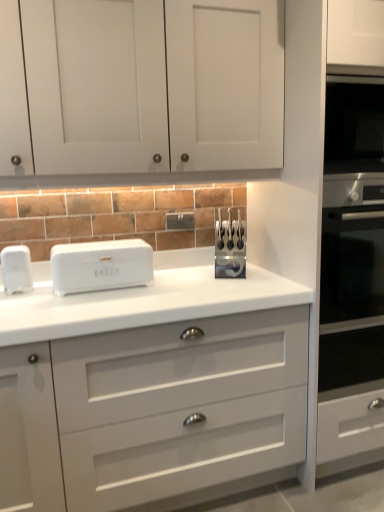
In order to face white glossy bread bin at center, placed as the second home appliance when sorted from left to right, should I rotate leftwards or rightwards?

Rotate left and turn 12.075 degrees.

What is the approximate height of white glossy bread bin at center, placed as the second home appliance when sorted from left to right?

white glossy bread bin at center, placed as the second home appliance when sorted from left to right, is 7.72 inches in height.

Find the location of a particular element. This screenshot has height=512, width=384. white plastic electric outlet at center is located at coordinates (180, 221).

Choose the correct answer: Is white glossy bread bin at center, placed as the second home appliance when sorted from left to right, inside white plastic bread bin at left, which appears as the first home appliance when viewed from the left, or outside it?

white glossy bread bin at center, placed as the second home appliance when sorted from left to right, is located beyond the bounds of white plastic bread bin at left, which appears as the first home appliance when viewed from the left.

There is a white glossy bread bin at center, placed as the second home appliance when sorted from left to right. Identify the location of home appliance above it (from a real-world perspective). The height and width of the screenshot is (512, 384). (16, 269).

Is white glossy bread bin at center, placed as the second home appliance when sorted from left to right, looking in the opposite direction of white plastic bread bin at left, which appears as the first home appliance when viewed from the left?

No, white glossy bread bin at center, placed as the second home appliance when sorted from left to right,'s orientation is not away from white plastic bread bin at left, which appears as the first home appliance when viewed from the left.

Is point (229, 370) less distant than point (180, 219)?

Yes, point (229, 370) is in front of point (180, 219).

Is white glossy chest of drawers at center looking in the opposite direction of white plastic electric outlet at center?

No, white plastic electric outlet at center is not at the back of white glossy chest of drawers at center.

From a real-world perspective, is white glossy chest of drawers at center positioned under white plastic electric outlet at center based on gravity?

Correct, in the physical world, white glossy chest of drawers at center is lower than white plastic electric outlet at center.

Identify the location of chest of drawers below the white plastic electric outlet at center (from a real-world perspective). (150, 386).

From a real-world perspective, between white glossy bread bin at center, placed as the second home appliance when sorted from left to right, and white matte cabinet doors at upper center, who is vertically higher?

white matte cabinet doors at upper center.

Between white glossy bread bin at center, placed as the second home appliance when sorted from left to right, and white matte cabinet doors at upper center, which one has smaller size?

white glossy bread bin at center, placed as the second home appliance when sorted from left to right.

From the image's perspective, which object appears higher, white glossy bread bin at center, placed as the second home appliance when sorted from left to right, or white matte cabinet doors at upper center?

white matte cabinet doors at upper center appears higher in the image.

Is white glossy bread bin at center, placed as the second home appliance when sorted from left to right, with white matte cabinet doors at upper center?

white glossy bread bin at center, placed as the second home appliance when sorted from left to right, is not next to white matte cabinet doors at upper center, and they're not touching.

Looking at this image, is white plastic electric outlet at center beside white glossy chest of drawers at center?

There is a gap between white plastic electric outlet at center and white glossy chest of drawers at center.

Measure the distance from white plastic electric outlet at center to white glossy chest of drawers at center.

A distance of 88.50 centimeters exists between white plastic electric outlet at center and white glossy chest of drawers at center.

Consider the image. Is white plastic electric outlet at center not within white glossy chest of drawers at center?

Yes.

From the image's perspective, between white glossy bread bin at center, positioned as the first home appliance in right-to-left order, and white glossy chest of drawers at center, which one is located above?

white glossy bread bin at center, positioned as the first home appliance in right-to-left order, from the image's perspective.

Which is in front, point (94, 283) or point (13, 417)?

The point (13, 417) is more forward.

Looking at this image, which of these two, white glossy bread bin at center, placed as the second home appliance when sorted from left to right, or white glossy chest of drawers at center, is smaller?

white glossy bread bin at center, placed as the second home appliance when sorted from left to right.

From a real-world perspective, between white glossy bread bin at center, positioned as the first home appliance in right-to-left order, and white glossy chest of drawers at center, who is vertically higher?

In real-world perspective, white glossy bread bin at center, positioned as the first home appliance in right-to-left order, is above.

Which is closer to the camera, (67,101) or (3,416)?

The point (3,416) is closer.

From the image's perspective, who appears lower, white matte cabinet doors at upper center or white glossy chest of drawers at center?

white glossy chest of drawers at center.

Who is bigger, white matte cabinet doors at upper center or white glossy chest of drawers at center?

With larger size is white glossy chest of drawers at center.

Is white matte cabinet doors at upper center in front of or behind white plastic bread bin at left, which appears as the first home appliance when viewed from the left, in the image?

white matte cabinet doors at upper center is in front of white plastic bread bin at left, which appears as the first home appliance when viewed from the left.

From the image's perspective, between white matte cabinet doors at upper center and white plastic bread bin at left, arranged as the 2th home appliance when viewed from the right, who is located below?

white plastic bread bin at left, arranged as the 2th home appliance when viewed from the right, appears lower in the image.

Identify the location of the 2nd home appliance behind the white matte cabinet doors at upper center. (16, 269).

Is white matte cabinet doors at upper center looking in the opposite direction of white plastic bread bin at left, arranged as the 2th home appliance when viewed from the right?

No, white matte cabinet doors at upper center is not facing away from white plastic bread bin at left, arranged as the 2th home appliance when viewed from the right.

I want to click on home appliance that is above the white glossy bread bin at center, placed as the second home appliance when sorted from left to right (from a real-world perspective), so click(16, 269).

At what (x,y) coordinates should I click in order to perform the action: click on chest of drawers below the white plastic electric outlet at center (from the image's perspective). Please return your answer as a coordinate pair (x, y). Image resolution: width=384 pixels, height=512 pixels. Looking at the image, I should click on (150, 386).

Based on their spatial positions, is white matte cabinet doors at upper center or white glossy bread bin at center, placed as the second home appliance when sorted from left to right, further from white glossy chest of drawers at center?

white matte cabinet doors at upper center lies further to white glossy chest of drawers at center than the other object.

Based on their spatial positions, is white matte cabinet doors at upper center or white plastic bread bin at left, arranged as the 2th home appliance when viewed from the right, closer to white glossy bread bin at center, positioned as the first home appliance in right-to-left order?

white plastic bread bin at left, arranged as the 2th home appliance when viewed from the right.

From the picture: Estimate the real-world distances between objects in this image. Which object is further from white glossy chest of drawers at center, white plastic bread bin at left, which appears as the first home appliance when viewed from the left, or white matte cabinet doors at upper center?

Based on the image, white matte cabinet doors at upper center appears to be further to white glossy chest of drawers at center.

Looking at this image, from the image, which object appears to be farther from white plastic electric outlet at center, white glossy bread bin at center, positioned as the first home appliance in right-to-left order, or white glossy chest of drawers at center?

white glossy chest of drawers at center is further to white plastic electric outlet at center.

Looking at the image, which one is located further to white matte cabinet doors at upper center, white glossy chest of drawers at center or white glossy bread bin at center, positioned as the first home appliance in right-to-left order?

Among the two, white glossy chest of drawers at center is located further to white matte cabinet doors at upper center.

When comparing their distances from white glossy chest of drawers at center, does white matte cabinet doors at upper center or white plastic electric outlet at center seem closer?

white matte cabinet doors at upper center is closer to white glossy chest of drawers at center.

When comparing their distances from white glossy chest of drawers at center, does white plastic bread bin at left, arranged as the 2th home appliance when viewed from the right, or white plastic electric outlet at center seem further?

white plastic electric outlet at center is positioned further to the anchor white glossy chest of drawers at center.

Based on their spatial positions, is white matte cabinet doors at upper center or white plastic bread bin at left, which appears as the first home appliance when viewed from the left, further from white glossy chest of drawers at center?

white matte cabinet doors at upper center is positioned further to the anchor white glossy chest of drawers at center.

Where is `home appliance located between white plastic bread bin at left, which appears as the first home appliance when viewed from the left, and white plastic electric outlet at center in the left-right direction`? Image resolution: width=384 pixels, height=512 pixels. home appliance located between white plastic bread bin at left, which appears as the first home appliance when viewed from the left, and white plastic electric outlet at center in the left-right direction is located at coordinates (101, 265).

Image resolution: width=384 pixels, height=512 pixels. Identify the location of home appliance between white glossy bread bin at center, positioned as the first home appliance in right-to-left order, and white glossy chest of drawers at center, in the vertical direction. (16, 269).

At what (x,y) coordinates should I click in order to perform the action: click on home appliance between white matte cabinet doors at upper center and white plastic bread bin at left, arranged as the 2th home appliance when viewed from the right, vertically. Please return your answer as a coordinate pair (x, y). The height and width of the screenshot is (512, 384). Looking at the image, I should click on (101, 265).

Where is `electric outlet that lies between white matte cabinet doors at upper center and white glossy chest of drawers at center from top to bottom`? The height and width of the screenshot is (512, 384). electric outlet that lies between white matte cabinet doors at upper center and white glossy chest of drawers at center from top to bottom is located at coordinates (180, 221).